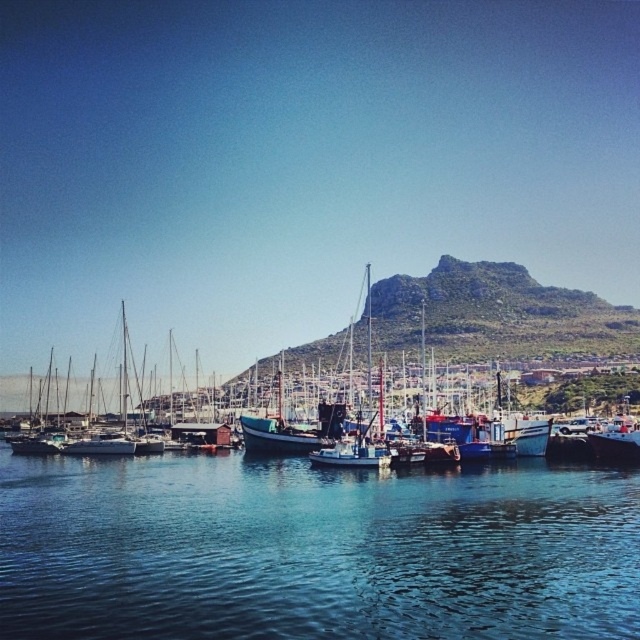
Question: Among these points, which one is nearest to the camera?

Choices:
 (A) (472, 268)
 (B) (637, 620)

Answer: (B)

Question: Among these points, which one is nearest to the camera?

Choices:
 (A) (276, 355)
 (B) (305, 515)

Answer: (B)

Question: Does blue water at center appear under rugged stone mountain at upper center?

Choices:
 (A) no
 (B) yes

Answer: (B)

Question: Which point is closer to the camera taking this photo?

Choices:
 (A) (486, 294)
 (B) (33, 458)

Answer: (B)

Question: Observing the image, what is the correct spatial positioning of blue water at center in reference to rugged stone mountain at upper center?

Choices:
 (A) right
 (B) left

Answer: (B)

Question: Can you confirm if blue water at center is positioned to the right of rugged stone mountain at upper center?

Choices:
 (A) no
 (B) yes

Answer: (A)